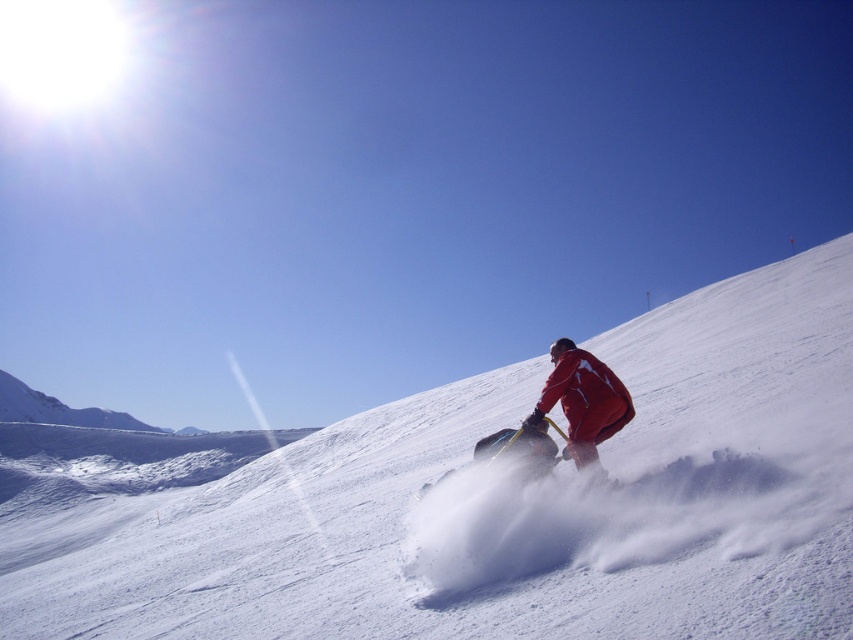
Question: Which object is closer to the camera taking this photo?

Choices:
 (A) shiny black snowboard at center
 (B) white powdery snow at center
 (C) red matte jacket at center

Answer: (B)

Question: Is the position of red matte jacket at center more distant than that of shiny black snowboard at center?

Choices:
 (A) no
 (B) yes

Answer: (B)

Question: Which point is farther to the camera?

Choices:
 (A) red matte jacket at center
 (B) white powdery snow at center

Answer: (A)

Question: Can you confirm if red matte jacket at center is positioned to the left of shiny black snowboard at center?

Choices:
 (A) no
 (B) yes

Answer: (A)

Question: Is white powdery snow at center positioned before shiny black snowboard at center?

Choices:
 (A) yes
 (B) no

Answer: (A)

Question: Which object appears farthest from the camera in this image?

Choices:
 (A) red matte jacket at center
 (B) white powdery snow at center
 (C) shiny black snowboard at center

Answer: (A)